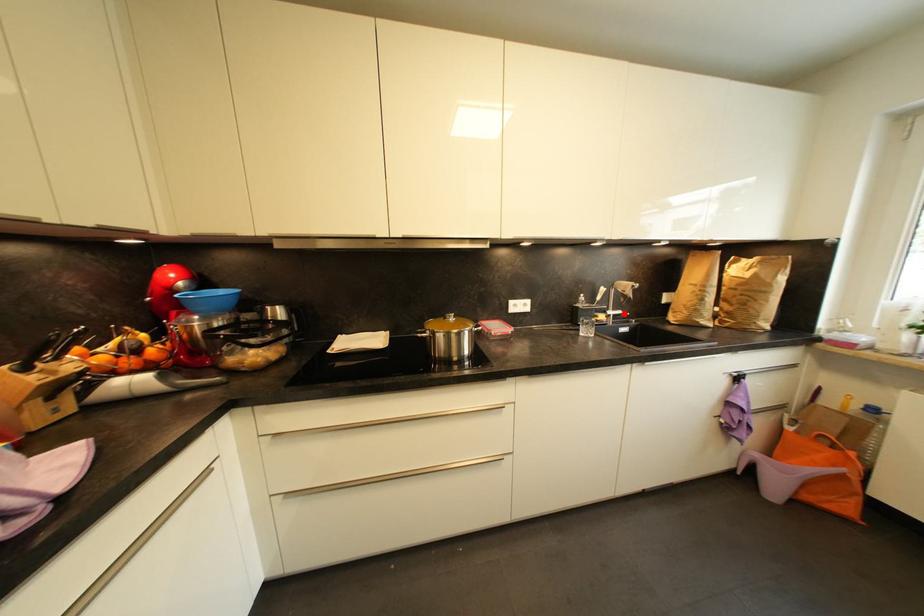
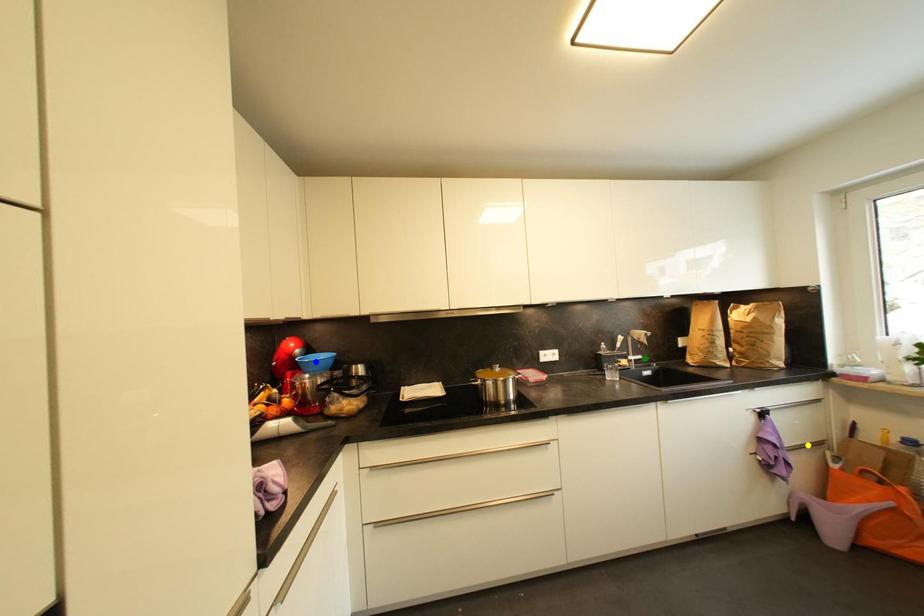
Question: I am providing you with two images of the same scene from different viewpoints. A red point is marked on the first image. You are given multiple points on the second image. Which spot in image 2 lines up with the point in image 1?

Choices:
 (A) blue point
 (B) green point
 (C) yellow point

Answer: (B)